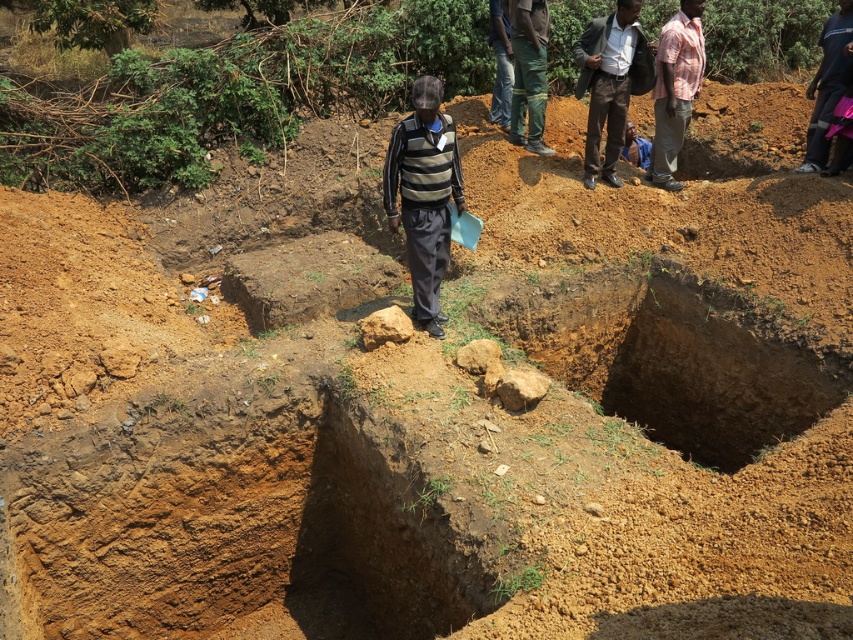
You are a construction worker standing at the center of the image. You need to locate the plaid cotton shirt at upper right. In which direction should you look to find it?

You should look to the upper right direction to find the plaid cotton shirt at upper right.

Where is the striped sweater at center located in the image?

The striped sweater at center is located at point (424, 195) in the image.